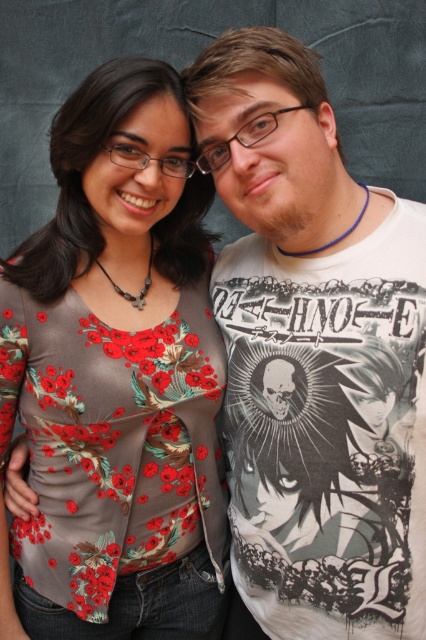
Which of these two, white printed t-shirt at center or floral-patterned fabric shirt at center, stands shorter?

white printed t-shirt at center is shorter.

Which is below, white printed t-shirt at center or floral-patterned fabric shirt at center?

floral-patterned fabric shirt at center is lower down.

Measure the distance between point (331, 196) and camera.

1.08 meters

The height and width of the screenshot is (640, 426). Identify the location of white printed t-shirt at center. (313, 353).